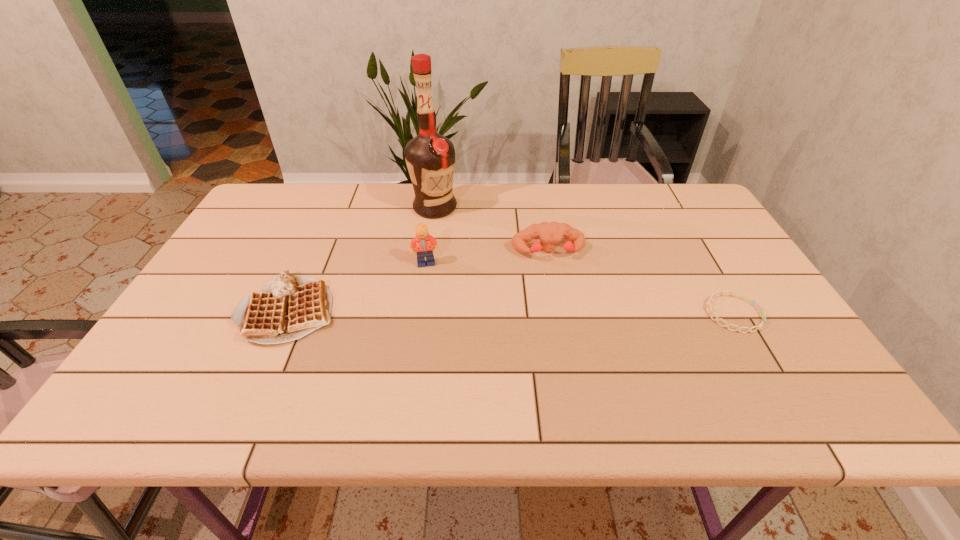
The image size is (960, 540). Find the location of `free space located 0.100m on the front and back of the farthest object`. free space located 0.100m on the front and back of the farthest object is located at coordinates (447, 239).

I want to click on blank area located 0.370m on the front and back of the farthest object, so click(474, 301).

Where is `vacant space located on the front and back of the farthest object`? The image size is (960, 540). vacant space located on the front and back of the farthest object is located at coordinates (468, 288).

Locate an element on the screen. This screenshot has width=960, height=540. vacant space situated with the gloves of the fourth object from left to right facing forward is located at coordinates (564, 307).

Where is `vacant position located 0.260m with the gloves of the fourth object from left to right facing forward`? This screenshot has height=540, width=960. vacant position located 0.260m with the gloves of the fourth object from left to right facing forward is located at coordinates (572, 335).

You are a GUI agent. You are given a task and a screenshot of the screen. Output one action in this format:
    pyautogui.click(x=<x>, y=<y>)
    Task: Click on the vacant space located with the gloves of the fourth object from left to right facing forward
    This screenshot has width=960, height=540.
    Given the screenshot: What is the action you would take?
    (x=578, y=356)

This screenshot has height=540, width=960. I want to click on free space located on the front-facing side of the second tallest object, so click(447, 287).

I want to click on vacant space located on the front-facing side of the second tallest object, so 475,325.

Where is `free point located 0.400m on the front-facing side of the second tallest object`? This screenshot has height=540, width=960. free point located 0.400m on the front-facing side of the second tallest object is located at coordinates (512, 373).

Find the location of a particular element. The image size is (960, 540). object that is at the far edge is located at coordinates (430, 157).